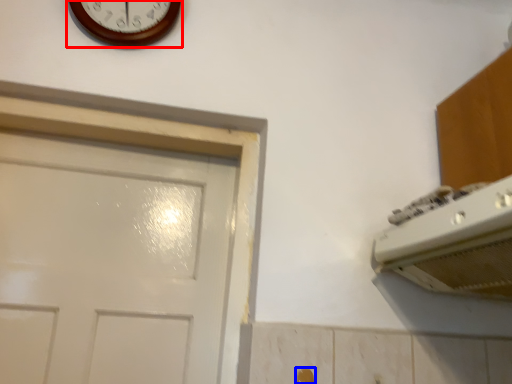
Question: Which point is closer to the camera, wall clock (highlighted by a red box) or door handle (highlighted by a blue box)?

Choices:
 (A) wall clock
 (B) door handle

Answer: (B)